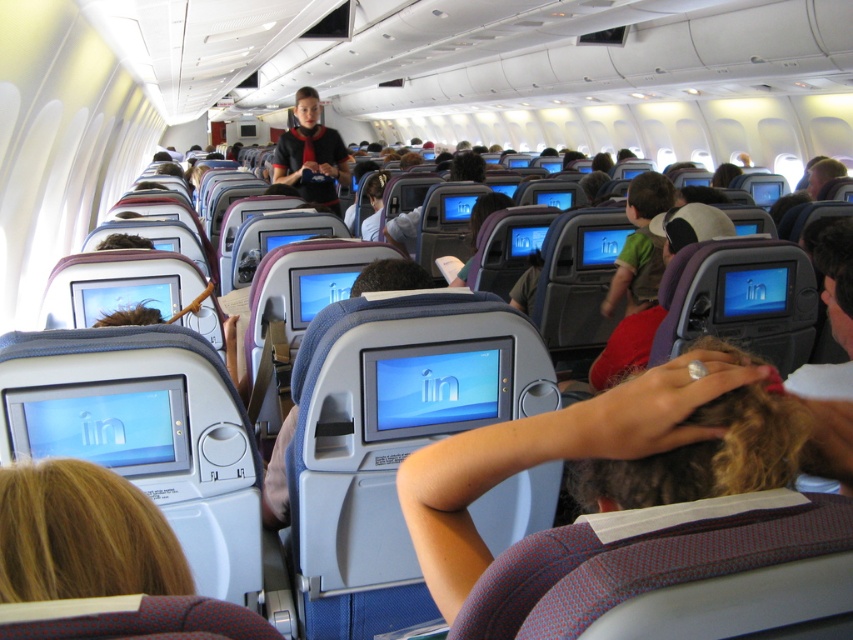
Who is positioned more to the left, dark brown hair at center or matte black uniform at center?

matte black uniform at center is more to the left.

Is dark brown hair at center in front of matte black uniform at center?

Yes, dark brown hair at center is closer to the viewer.

Between point (476, 460) and point (293, 179), which one is positioned in front?

Point (476, 460)

Where is `dark brown hair at center`? The image size is (853, 640). dark brown hair at center is located at coordinates (610, 454).